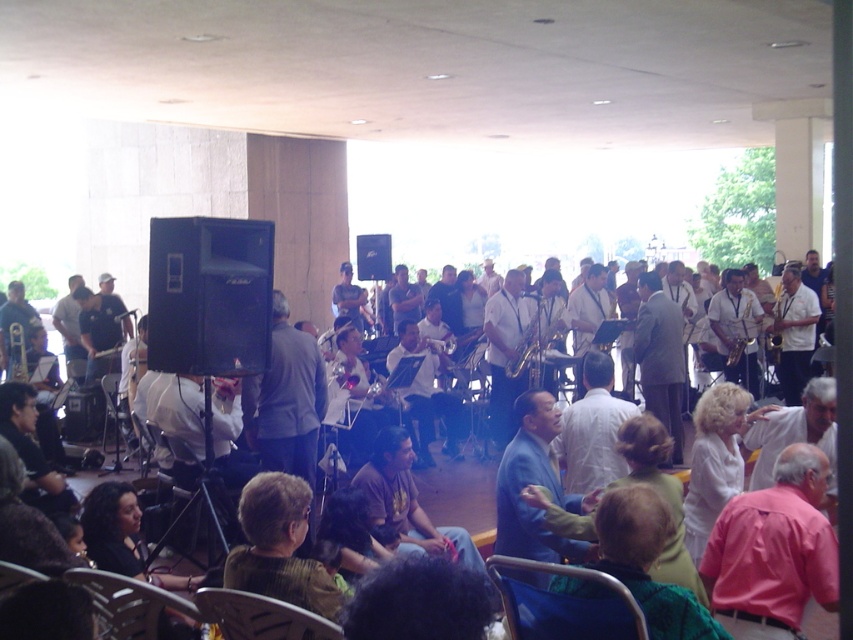
Can you confirm if pink fabric shirt at lower right is positioned above matte white shirt at center?

No, pink fabric shirt at lower right is not above matte white shirt at center.

Does pink fabric shirt at lower right appear on the left side of matte white shirt at center?

In fact, pink fabric shirt at lower right is to the right of matte white shirt at center.

Does point (814, 454) come behind point (450, 442)?

That is False.

What are the coordinates of `pink fabric shirt at lower right` in the screenshot? It's located at (773, 552).

Which is in front, point (669, 314) or point (314, 620)?

Point (314, 620)

Identify the location of matte gray suit at center. (660, 358).

Identify the location of matte gray suit at center. The height and width of the screenshot is (640, 853). (660, 358).

Which is more to the left, black plastic speaker at center or green striped shirt at lower center?

black plastic speaker at center

This screenshot has width=853, height=640. I want to click on black plastic speaker at center, so click(x=209, y=296).

Between point (230, 269) and point (289, 577), which one is positioned behind?

The point (230, 269) is more distant.

You are a GUI agent. You are given a task and a screenshot of the screen. Output one action in this format:
    pyautogui.click(x=<x>, y=<y>)
    Task: Click on the black plastic speaker at center
    This screenshot has height=640, width=853.
    Given the screenshot: What is the action you would take?
    pyautogui.click(x=209, y=296)